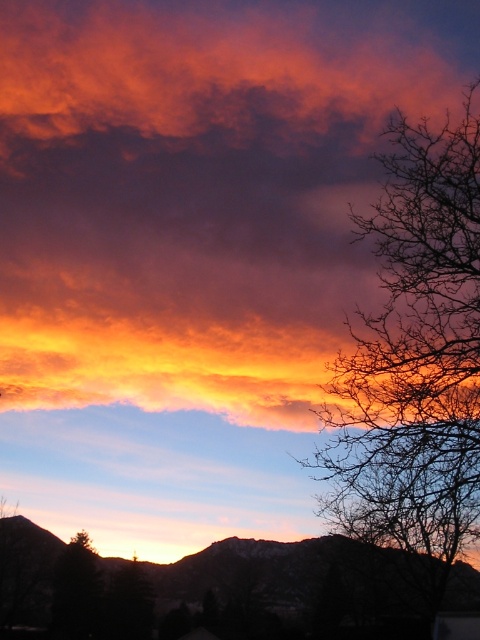
You are an artist trying to paint the sunset scene. You have to decide which object to paint first based on their sizes. According to the scene, which object should you start with, the vivid orange cloud at upper center or the bare branches at right?

The vivid orange cloud at upper center is larger in size than the bare branches at right, so you should start with the vivid orange cloud at upper center as it requires more space and detail.

You are standing in the sunset scene and want to take a photo. There are two points marked in the image, point 1 at coordinates point (362, 132) and point 2 at coordinates point (354, 212). Which point is closer to your camera?

Point (362, 132) is further to the camera than point (354, 212), so point (354, 212) is closer to the camera.

You are an artist trying to paint the sunset scene. You want to ensure the bare branches at right are taller than the vivid orange cloud at upper center. Based on the image, is this accurate?

The vivid orange cloud at upper center is not as tall as the bare branches at right, so the bare branches at right are indeed taller than the vivid orange cloud at upper center in the image.